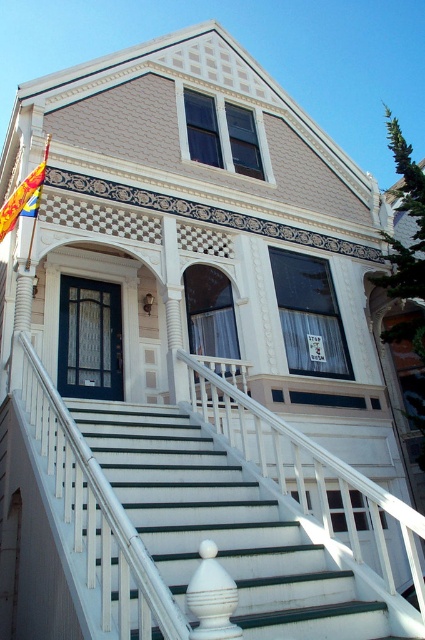
You are a delivery person with a large package that is 8 feet long. You need to carry it up the white painted wood stairs at center. Can you maneuver the package around the white glossy post at center without hitting it?

The distance between the white painted wood stairs at center and the white glossy post at center is 9.12 feet. Since the package is 8 feet long, it should fit with some space to spare, so you can maneuver it safely.

You are standing in front of the Victorian house and want to touch both the white glossy post at center and the yellow and blue striped flag at upper left. Which object can you reach first without moving your position?

You can reach the white glossy post at center first because it is closer to the viewer than the yellow and blue striped flag at upper left.

You are a visitor approaching the house and need to reach the front door. The white painted wood stairs at center lead to the entrance. However, there is a yellow and blue striped flag at upper left that might block your view. Does the flag obscure the view of the stairs?

The white painted wood stairs at center is shorter than the yellow and blue striped flag at upper left, so the flag is taller and could potentially block the view of the stairs.